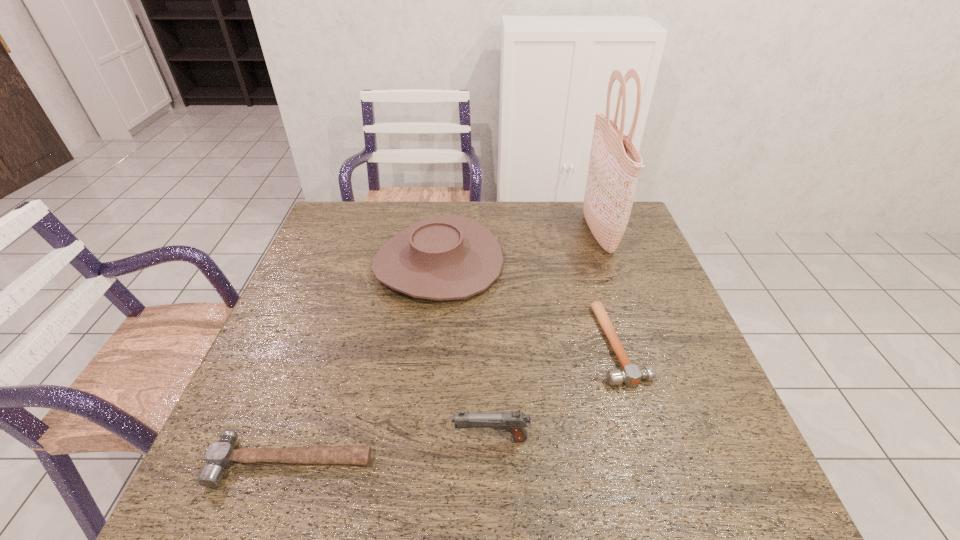
Find the location of a particular element. blank region between the farther hammer and the nearer hammer is located at coordinates (455, 403).

I want to click on vacant space in between the right hammer and the shopping bag, so click(x=609, y=288).

The height and width of the screenshot is (540, 960). I want to click on vacant space in between the cowboy hat and the tallest object, so click(x=518, y=247).

This screenshot has height=540, width=960. I want to click on empty space that is in between the tallest object and the left hammer, so click(445, 347).

Where is `object that is the second closest to the right hammer`? The image size is (960, 540). object that is the second closest to the right hammer is located at coordinates (514, 422).

Select which object appears as the third closest to the gun. Please provide its 2D coordinates. Your answer should be formatted as a tuple, i.e. [(x, y)], where the tuple contains the x and y coordinates of a point satisfying the conditions above.

[(449, 257)]